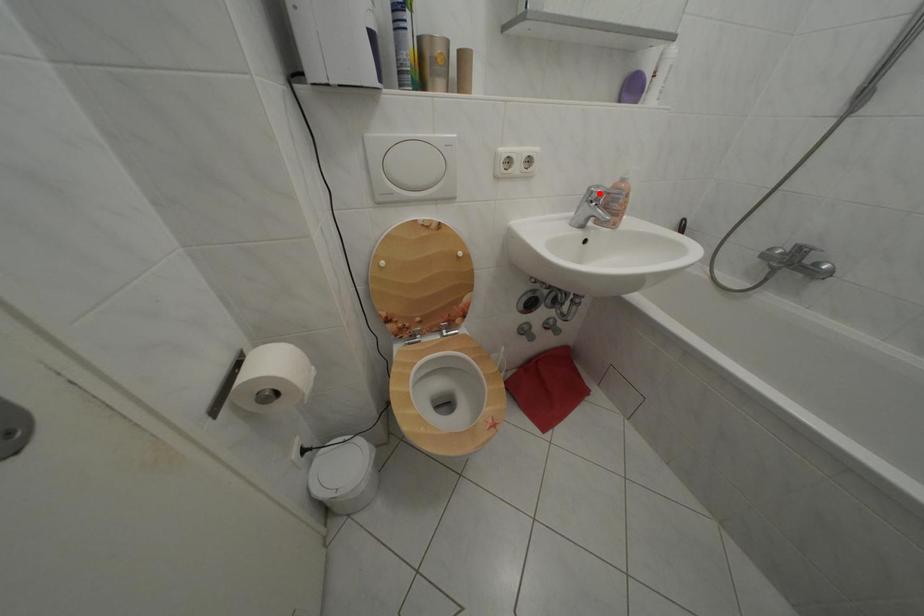
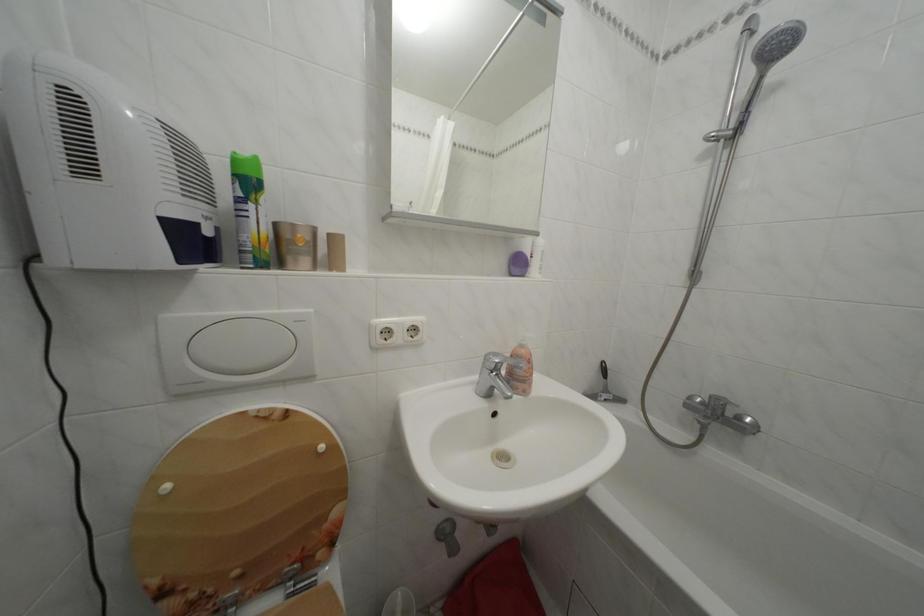
Locate, in the second image, the point that corresponds to the highlighted location in the first image.

(495, 362)